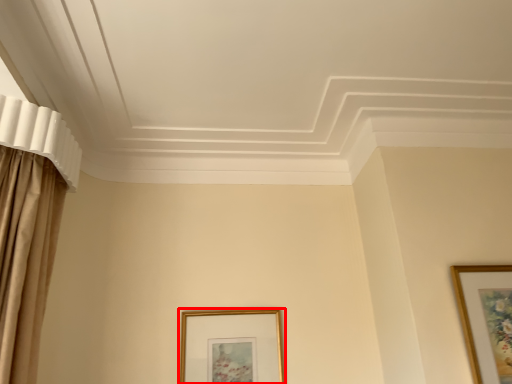
Question: From the image's perspective, where is picture frame (annotated by the red box) located in relation to picture frame in the image?

Choices:
 (A) below
 (B) above

Answer: (A)